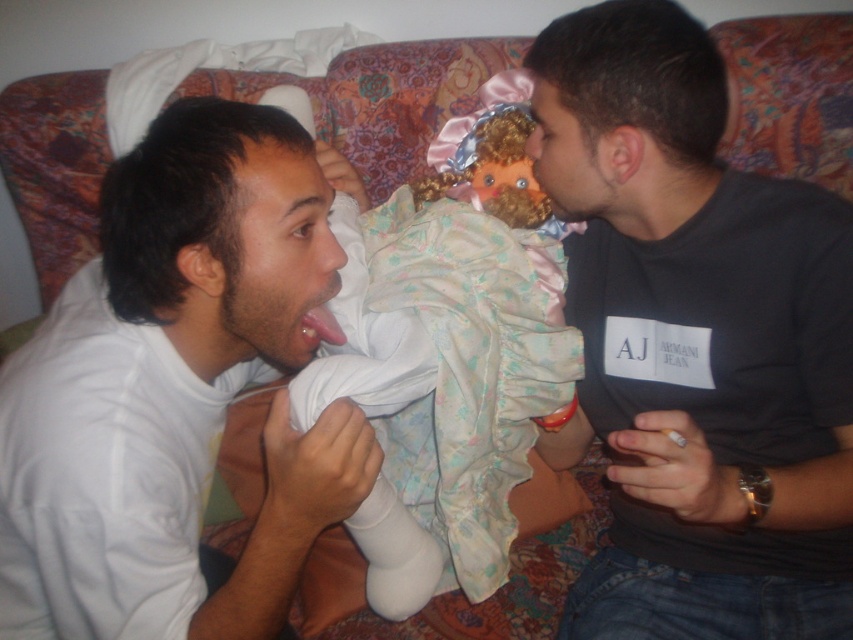
Question: Which object is the farthest from the pink glossy tongue at center?

Choices:
 (A) white soft shirt at left
 (B) black matte shirt at center
 (C) silky pastel dress at center

Answer: (B)

Question: Can you confirm if white soft shirt at left is bigger than silky pastel dress at center?

Choices:
 (A) no
 (B) yes

Answer: (A)

Question: Which of the following is the farthest from the observer?

Choices:
 (A) (491, 515)
 (B) (263, 216)
 (C) (811, 369)
 (D) (340, 336)

Answer: (A)

Question: Is black matte shirt at center below pink glossy tongue at center?

Choices:
 (A) yes
 (B) no

Answer: (A)

Question: Among these points, which one is farthest from the camera?

Choices:
 (A) (712, 250)
 (B) (463, 216)
 (C) (334, 332)
 (D) (164, 556)

Answer: (B)

Question: Can you confirm if white soft shirt at left is wider than silky pastel dress at center?

Choices:
 (A) no
 (B) yes

Answer: (B)